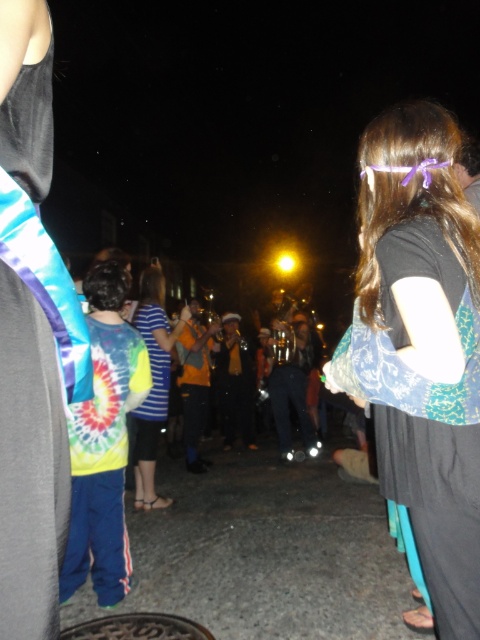
Between black fabric headband at upper right and gray metallic manhole cover at lower center, which one is positioned lower?

Positioned lower is gray metallic manhole cover at lower center.

Is point (384, 236) closer to camera compared to point (88, 627)?

Yes.

Where is `black fabric headband at upper right`? The width and height of the screenshot is (480, 640). black fabric headband at upper right is located at coordinates (420, 346).

Between black fabric headband at upper right and striped fabric at center, which one is positioned higher?

black fabric headband at upper right is higher up.

Does point (478, 499) lie behind point (133, 410)?

No.

I want to click on black fabric headband at upper right, so click(420, 346).

Between striped fabric at center and gray metallic manhole cover at lower center, which one is positioned lower?

gray metallic manhole cover at lower center

Between point (146, 474) and point (201, 627), which one is positioned behind?

Point (146, 474)

I want to click on striped fabric at center, so click(152, 387).